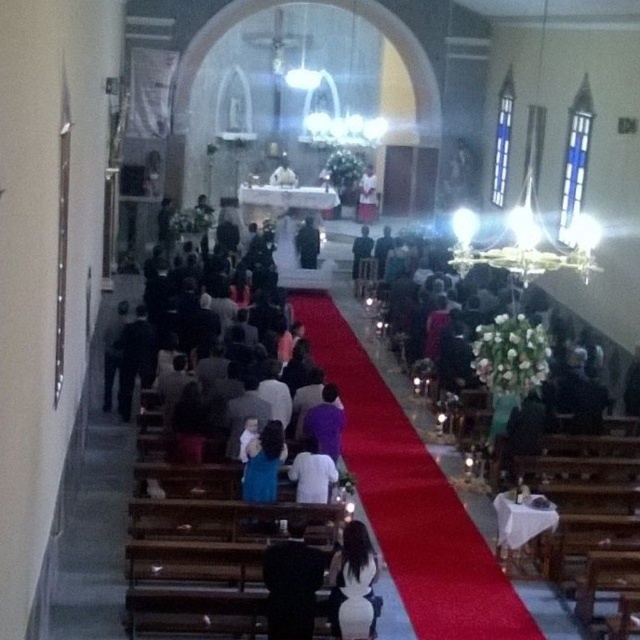
Is point (330, 593) in front of point (358, 205)?

Yes, point (330, 593) is closer to viewer.

Does white satin dress at center come in front of white cloth at center?

Yes, white satin dress at center is in front of white cloth at center.

You are a GUI agent. You are given a task and a screenshot of the screen. Output one action in this format:
    pyautogui.click(x=<x>, y=<y>)
    Task: Click on the white satin dress at center
    The height and width of the screenshot is (640, 640).
    Given the screenshot: What is the action you would take?
    pyautogui.click(x=353, y=584)

Between purple fabric dress at center and black fabric at lower center, which one appears on the left side from the viewer's perspective?

purple fabric dress at center is more to the left.

Is purple fabric dress at center smaller than black fabric at lower center?

No, purple fabric dress at center is not smaller than black fabric at lower center.

Locate an element on the screen. purple fabric dress at center is located at coordinates (202, 544).

Is black velvet suit at center thinner than white cloth at center?

Indeed, black velvet suit at center has a lesser width compared to white cloth at center.

Between point (296, 243) and point (372, 204), which one is positioned in front?

Point (296, 243) is in front.

You are a GUI agent. You are given a task and a screenshot of the screen. Output one action in this format:
    pyautogui.click(x=<x>, y=<y>)
    Task: Click on the black velvet suit at center
    The image size is (640, 640).
    Given the screenshot: What is the action you would take?
    pyautogui.click(x=307, y=243)